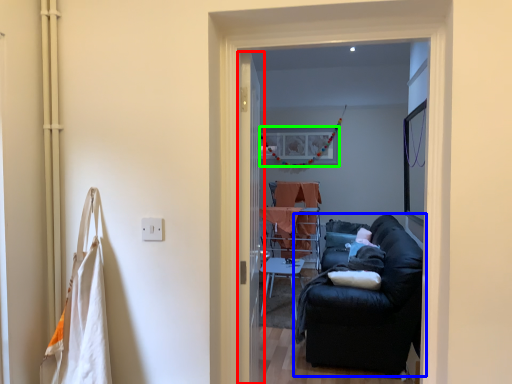
Question: Which object is the farthest from screen door (highlighted by a red box)? Choose among these: studio couch (highlighted by a blue box) or picture frame (highlighted by a green box).

Choices:
 (A) studio couch
 (B) picture frame

Answer: (B)